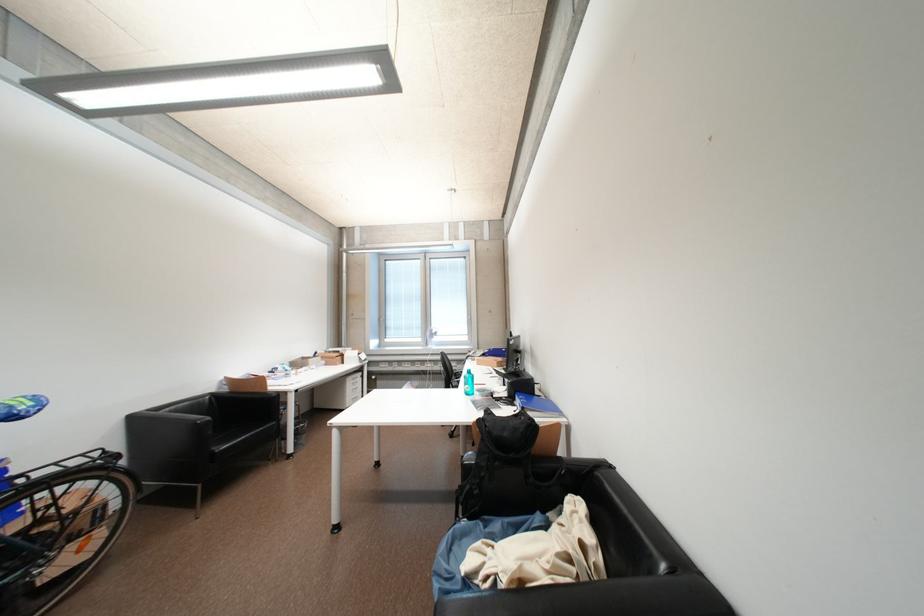
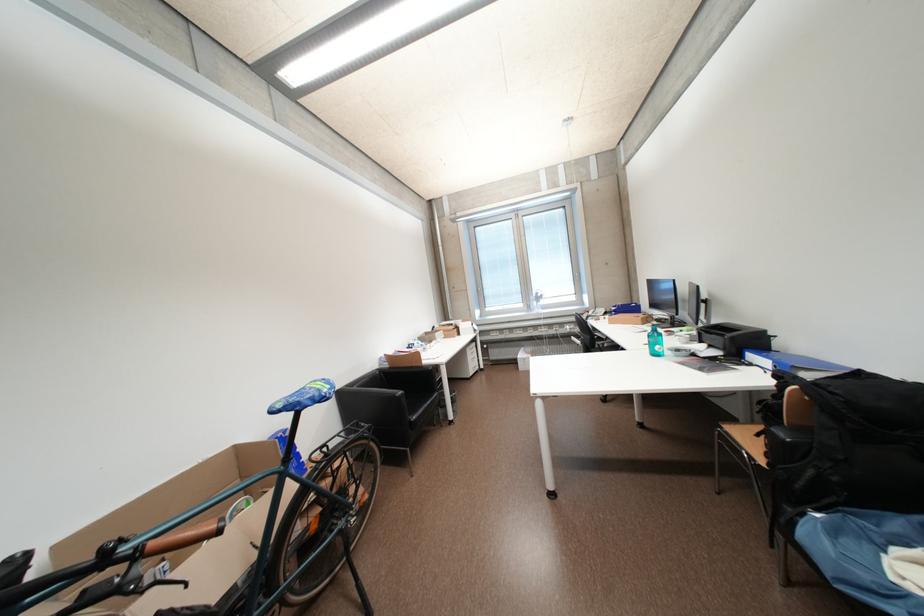
The point at (493, 428) is marked in the first image. Where is the corresponding point in the second image?

(841, 395)